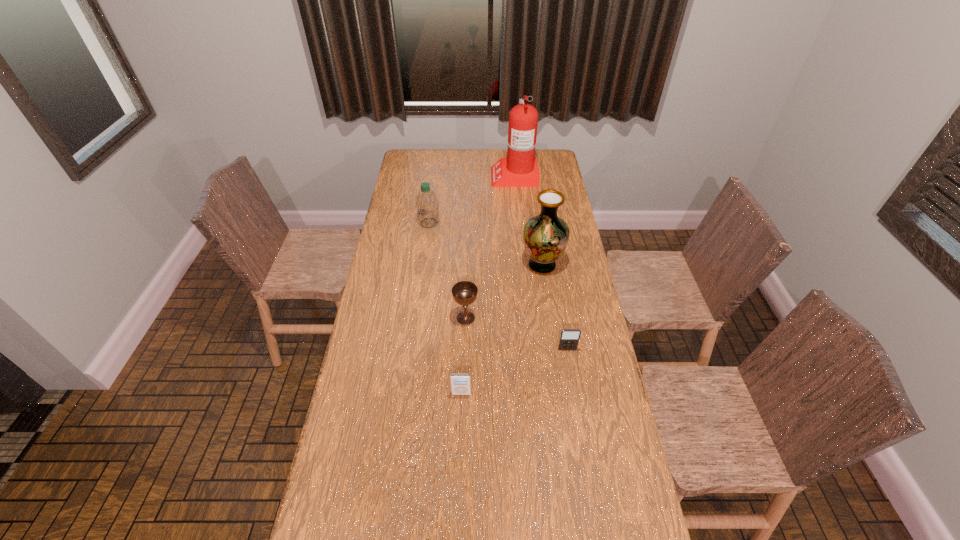
The height and width of the screenshot is (540, 960). Identify the location of the tallest object. (520, 169).

At what (x,y) coordinates should I click in order to perform the action: click on the farthest object. Please return your answer as a coordinate pair (x, y). This screenshot has height=540, width=960. Looking at the image, I should click on (520, 169).

In order to click on vase in this screenshot , I will do `click(545, 236)`.

This screenshot has width=960, height=540. Find the location of `the third farthest object`. the third farthest object is located at coordinates (545, 236).

Where is `the fifth nearest object`? the fifth nearest object is located at coordinates (427, 204).

Image resolution: width=960 pixels, height=540 pixels. I want to click on the leftmost object, so click(x=427, y=204).

Where is `the third shortest object`? The width and height of the screenshot is (960, 540). the third shortest object is located at coordinates (464, 293).

The height and width of the screenshot is (540, 960). What are the coordinates of `chalice` in the screenshot? It's located at (464, 293).

This screenshot has width=960, height=540. In order to click on the fifth farthest object in this screenshot , I will do `click(569, 338)`.

Where is `the farther iPod`? the farther iPod is located at coordinates (569, 338).